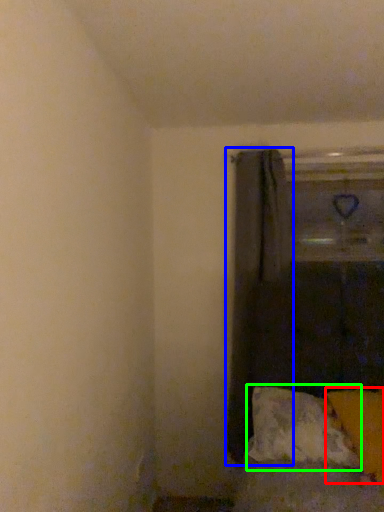
Question: Which object is positioned farthest from pillow (highlighted by a red box)? Select from curtain (highlighted by a blue box) and pillow (highlighted by a green box).

Choices:
 (A) curtain
 (B) pillow

Answer: (A)